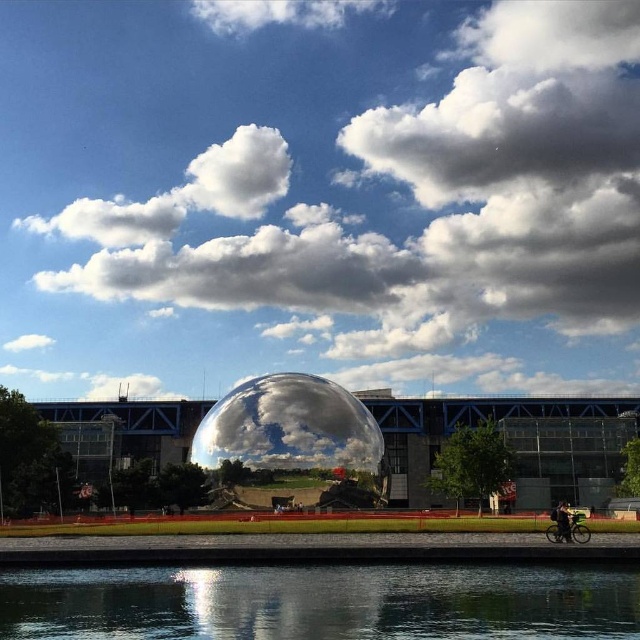
Is point (545, 568) farther from camera compared to point (568, 515)?

No, (545, 568) is closer to viewer.

Does transparent glass water at lower center appear over dark gray fabric jacket at lower right?

Correct, transparent glass water at lower center is located above dark gray fabric jacket at lower right.

The image size is (640, 640). I want to click on transparent glass water at lower center, so coord(321,602).

Is white fluffy cloud at center above transparent glass bubble at center?

Yes, white fluffy cloud at center is above transparent glass bubble at center.

Identify the location of white fluffy cloud at center. Image resolution: width=640 pixels, height=640 pixels. (320, 195).

Is point (380, 284) farther from camera compared to point (273, 400)?

Yes, it is behind point (273, 400).

Locate an element on the screen. white fluffy cloud at center is located at coordinates (320, 195).

Between polished metallic sphere at center and dark gray fabric jacket at lower right, which one is positioned lower?

dark gray fabric jacket at lower right is lower down.

Is polished metallic sphere at center positioned before dark gray fabric jacket at lower right?

That is False.

I want to click on polished metallic sphere at center, so click(512, 444).